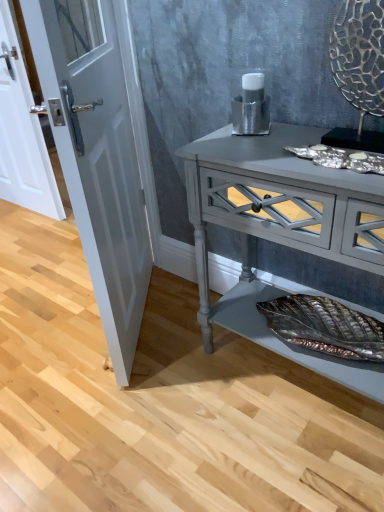
Question: Does white glossy door at left, acting as the second door starting from the left, have a smaller size compared to matte gray console table at center?

Choices:
 (A) yes
 (B) no

Answer: (A)

Question: Can you confirm if white glossy door at left, which is counted as the 1th door, starting from the front, is thinner than matte gray console table at center?

Choices:
 (A) yes
 (B) no

Answer: (A)

Question: Can we say white glossy door at left, acting as the second door starting from the left, lies outside matte gray console table at center?

Choices:
 (A) no
 (B) yes

Answer: (B)

Question: Is matte gray console table at center surrounded by white glossy door at left, acting as the second door starting from the left?

Choices:
 (A) no
 (B) yes

Answer: (A)

Question: Is white glossy door at left, acting as the second door starting from the left, next to matte gray console table at center and touching it?

Choices:
 (A) no
 (B) yes

Answer: (A)

Question: Is white glossy door at left, arranged as the first door when viewed from the right, wider than matte gray console table at center?

Choices:
 (A) no
 (B) yes

Answer: (A)

Question: Considering the relative sizes of white glossy door at left, arranged as the second door when viewed from the front, and matte gray console table at center in the image provided, is white glossy door at left, arranged as the second door when viewed from the front, thinner than matte gray console table at center?

Choices:
 (A) yes
 (B) no

Answer: (A)

Question: Is white glossy door at left, the 1th door in the back-to-front sequence, looking in the opposite direction of matte gray console table at center?

Choices:
 (A) no
 (B) yes

Answer: (A)

Question: Can you confirm if white glossy door at left, the first door positioned from the left, is shorter than matte gray console table at center?

Choices:
 (A) yes
 (B) no

Answer: (B)

Question: From the image's perspective, is white glossy door at left, the 1th door in the back-to-front sequence, on matte gray console table at center?

Choices:
 (A) yes
 (B) no

Answer: (A)

Question: Is white glossy door at left, which is the second door in right-to-left order, not near matte gray console table at center?

Choices:
 (A) yes
 (B) no

Answer: (A)

Question: Is white glossy door at left, the 1th door in the back-to-front sequence, not inside matte gray console table at center?

Choices:
 (A) yes
 (B) no

Answer: (A)

Question: Considering the relative sizes of matte gray console table at center and white glossy door at left, the first door positioned from the left, in the image provided, is matte gray console table at center bigger than white glossy door at left, the first door positioned from the left,?

Choices:
 (A) yes
 (B) no

Answer: (A)